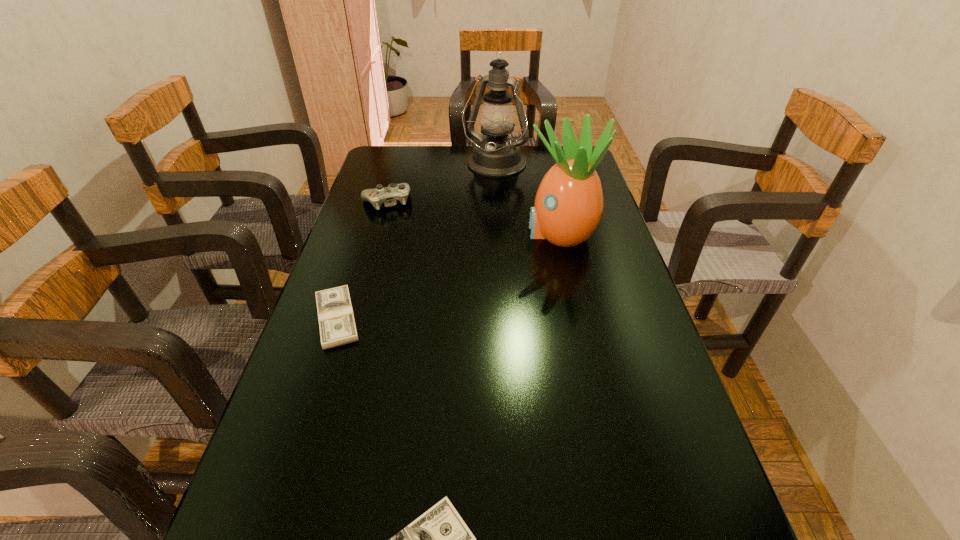
This screenshot has height=540, width=960. In order to click on the farthest object in this screenshot , I will do `click(496, 155)`.

Where is `pineapple`? The image size is (960, 540). pineapple is located at coordinates (569, 203).

Locate an element on the screen. control is located at coordinates (388, 195).

At what (x,y) coordinates should I click in order to perform the action: click on the second shortest object. Please return your answer as a coordinate pair (x, y). This screenshot has width=960, height=540. Looking at the image, I should click on (336, 319).

Where is `the taller dollar`? the taller dollar is located at coordinates (336, 319).

Identify the location of vacant region located 0.140m on the right of the farthest object. (565, 165).

The image size is (960, 540). Identify the location of vacant region located at the entrance of the pineapple. (420, 232).

Identify the location of vacant position located at the entrance of the pineapple. (499, 232).

This screenshot has width=960, height=540. Find the location of `vacant region located at the entrance of the pineapple`. vacant region located at the entrance of the pineapple is located at coordinates (475, 232).

You are a GUI agent. You are given a task and a screenshot of the screen. Output one action in this format:
    pyautogui.click(x=<x>, y=<y>)
    Task: Click on the vacant space located 0.280m on the front of the third tallest object
    The height and width of the screenshot is (540, 960).
    Given the screenshot: What is the action you would take?
    pyautogui.click(x=365, y=275)